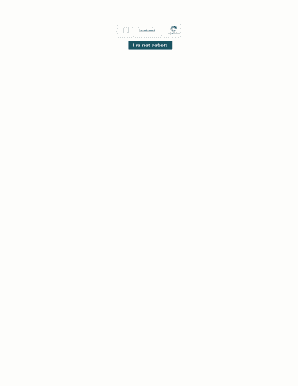
Identify the location of picture. Image resolution: width=298 pixels, height=386 pixels. [x=177, y=26].